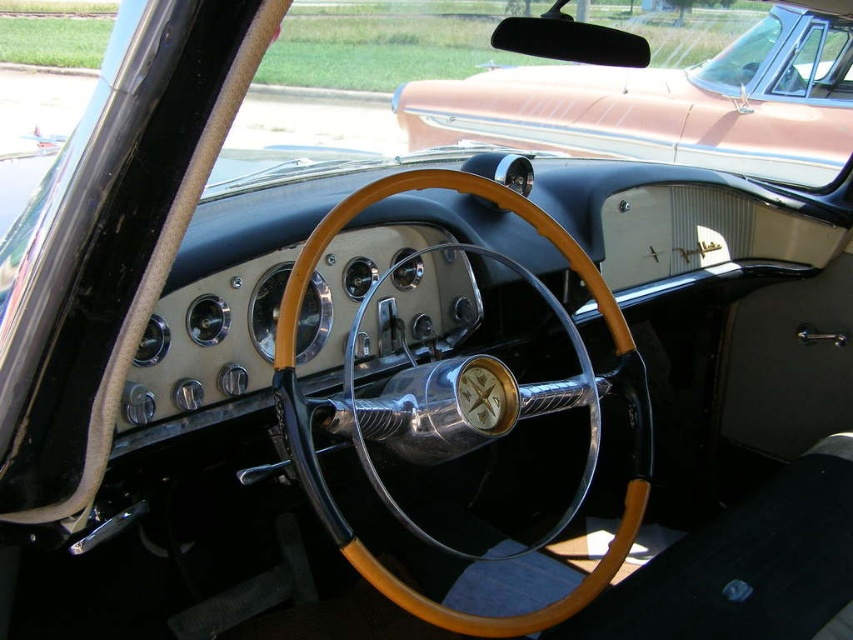
Question: From the image, what is the correct spatial relationship of wooden/leather steering wheel at center in relation to clear glass windshield at upper center?

Choices:
 (A) right
 (B) left

Answer: (B)

Question: Is matte orange car at upper center below clear glass windshield at upper center?

Choices:
 (A) yes
 (B) no

Answer: (A)

Question: Among these objects, which one is nearest to the camera?

Choices:
 (A) wooden/leather steering wheel at center
 (B) clear glass windshield at upper center
 (C) matte orange car at upper center

Answer: (A)

Question: Can you confirm if wooden/leather steering wheel at center is positioned to the left of clear glass windshield at upper center?

Choices:
 (A) yes
 (B) no

Answer: (A)

Question: Which of these objects is positioned farthest from the wooden/leather steering wheel at center?

Choices:
 (A) matte orange car at upper center
 (B) clear glass windshield at upper center

Answer: (B)

Question: Based on their relative distances, which object is nearer to the clear glass windshield at upper center?

Choices:
 (A) matte orange car at upper center
 (B) wooden/leather steering wheel at center

Answer: (A)